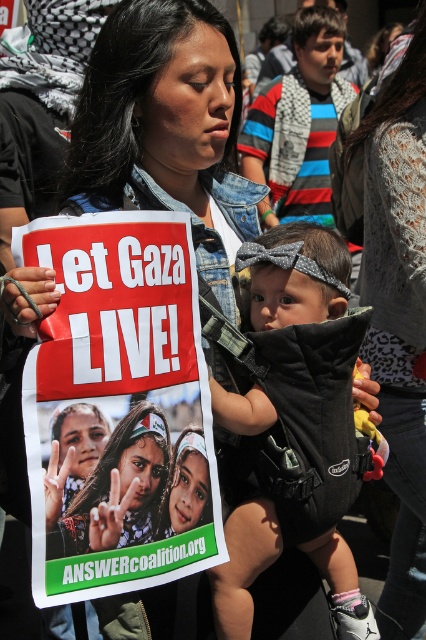
Question: Which point appears farthest from the camera in this image?

Choices:
 (A) (316, 253)
 (B) (219, 506)

Answer: (A)

Question: Does white paper poster at center have a smaller size compared to black fabric baby carrier at center?

Choices:
 (A) no
 (B) yes

Answer: (A)

Question: Can you confirm if white paper poster at center is positioned below black fabric baby carrier at center?

Choices:
 (A) no
 (B) yes

Answer: (B)

Question: Is white paper poster at center above black fabric baby carrier at center?

Choices:
 (A) yes
 (B) no

Answer: (B)

Question: Which point appears farthest from the camera in this image?

Choices:
 (A) (126, 468)
 (B) (317, 237)

Answer: (B)